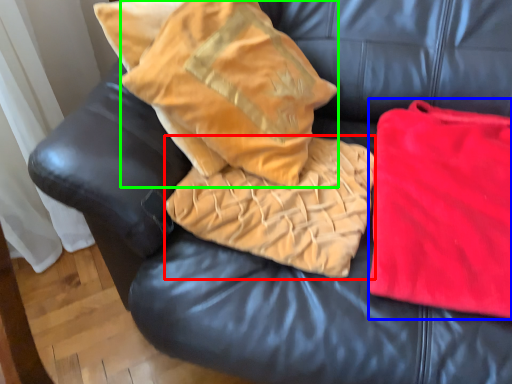
Question: Which object is the closest to the cloth (highlighted by a red box)? Choose among these: material (highlighted by a blue box) or throw pillow (highlighted by a green box).

Choices:
 (A) material
 (B) throw pillow

Answer: (B)